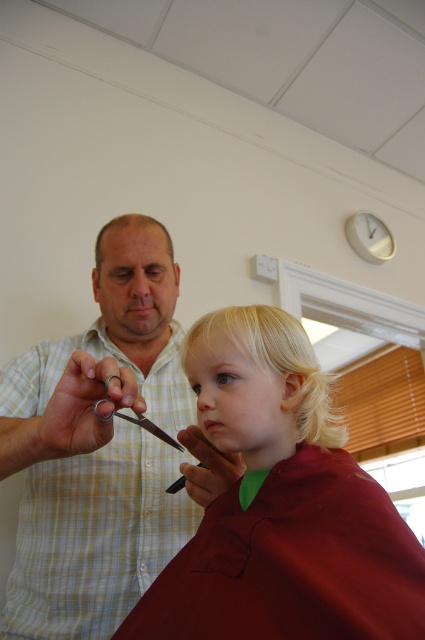
Does point (271, 348) come in front of point (99, 417)?

No.

Does blonde silky hair at center appear over metallic shears at center?

Yes, blonde silky hair at center is above metallic shears at center.

Identify the location of blonde silky hair at center. The width and height of the screenshot is (425, 640). (274, 364).

Between point (158, 394) and point (295, 388), which one is positioned in front?

Point (295, 388)

This screenshot has height=640, width=425. Describe the element at coordinates (99, 448) in the screenshot. I see `checkered fabric shirt at upper left` at that location.

In order to click on checkered fabric shirt at upper left in this screenshot , I will do `click(99, 448)`.

Between blonde hair at center and blonde silky hair at center, which one is positioned higher?

blonde silky hair at center is higher up.

Can you confirm if blonde hair at center is taller than blonde silky hair at center?

Correct, blonde hair at center is much taller as blonde silky hair at center.

The image size is (425, 640). In order to click on blonde hair at center in this screenshot , I will do `click(280, 506)`.